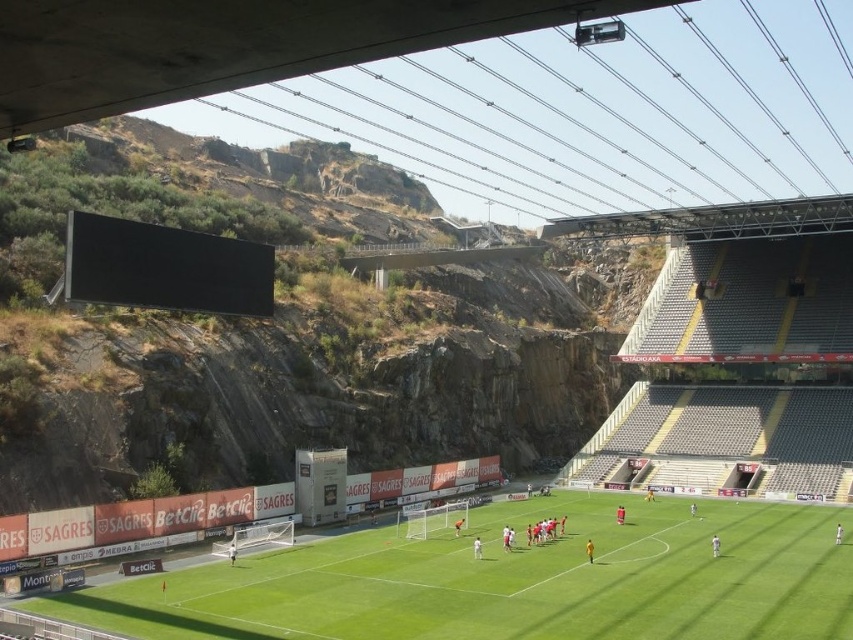
Question: Observing the image, what is the correct spatial positioning of white matte soccer goal at lower center in reference to white matte soccer goal at center?

Choices:
 (A) right
 (B) left

Answer: (B)

Question: Which object is farther from the camera taking this photo?

Choices:
 (A) white matte soccer goal at center
 (B) white matte soccer goal at lower center

Answer: (A)

Question: Estimate the real-world distances between objects in this image. Which object is farther from the green grass football field at center?

Choices:
 (A) white matte soccer goal at lower center
 (B) white matte soccer goal at center

Answer: (A)

Question: Based on their relative distances, which object is farther from the green grass football field at center?

Choices:
 (A) white matte soccer goal at lower center
 (B) white matte soccer goal at center

Answer: (A)

Question: Does green grass football field at center appear on the right side of white matte soccer goal at center?

Choices:
 (A) yes
 (B) no

Answer: (A)

Question: Is green grass football field at center wider than white matte soccer goal at lower center?

Choices:
 (A) yes
 (B) no

Answer: (A)